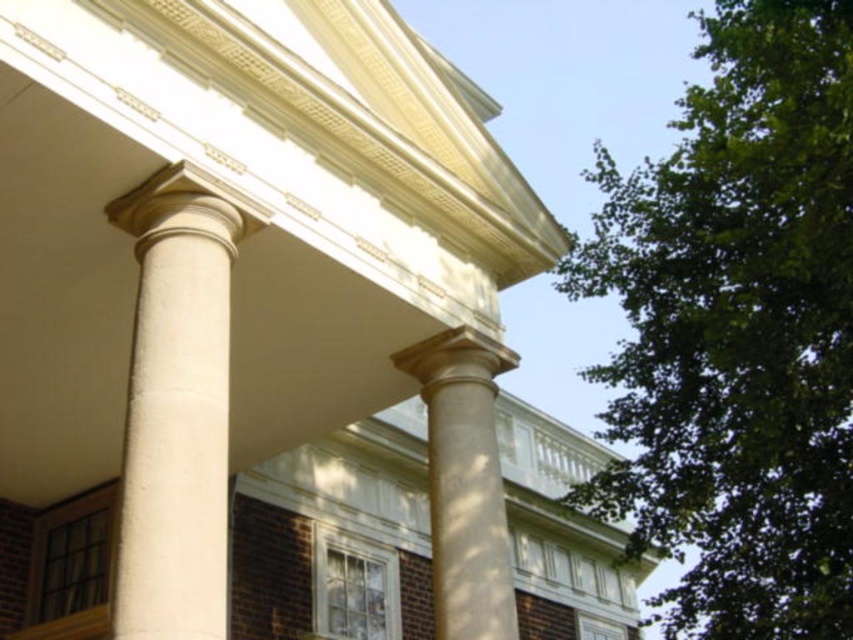
Question: Which point appears closest to the camera in this image?

Choices:
 (A) (502, 513)
 (B) (795, 419)
 (C) (180, 358)

Answer: (C)

Question: Estimate the real-world distances between objects in this image. Which object is closer to the white stone column at left?

Choices:
 (A) green leafy tree at upper right
 (B) smooth beige column at center

Answer: (B)

Question: Can you confirm if green leafy tree at upper right is positioned to the left of smooth beige column at center?

Choices:
 (A) no
 (B) yes

Answer: (A)

Question: Based on their relative distances, which object is farther from the smooth beige column at center?

Choices:
 (A) green leafy tree at upper right
 (B) white stone column at left

Answer: (A)

Question: Does white stone column at left have a larger size compared to smooth beige column at center?

Choices:
 (A) no
 (B) yes

Answer: (A)

Question: Is green leafy tree at upper right to the left of white stone column at left from the viewer's perspective?

Choices:
 (A) yes
 (B) no

Answer: (B)